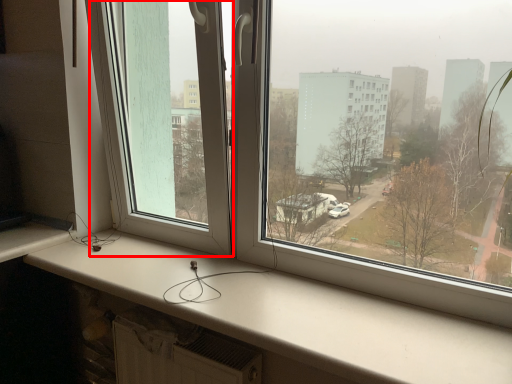
Question: In this image, where is window screen (annotated by the red box) located relative to window sill?

Choices:
 (A) right
 (B) left

Answer: (B)